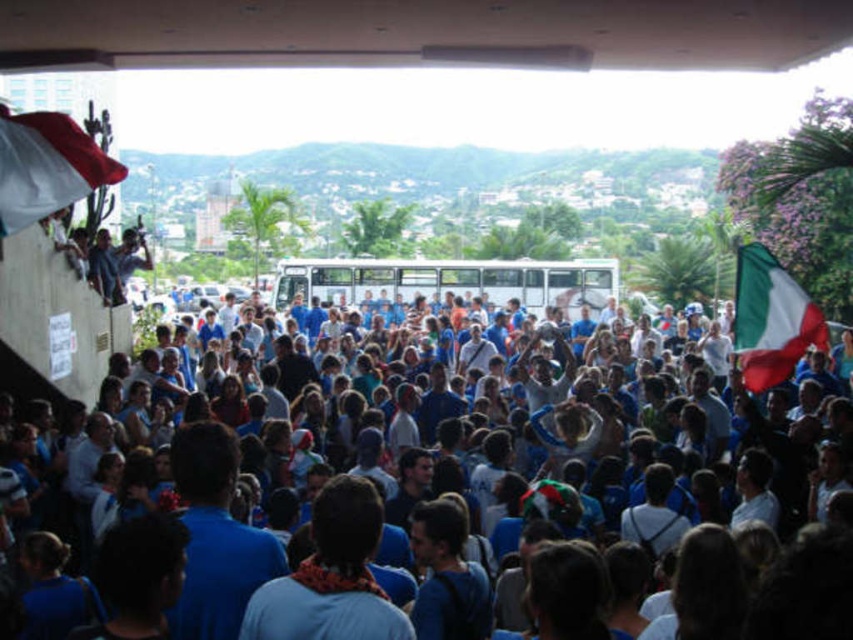
Question: Does blue fabric crowd at center have a lesser width compared to green and white fabric flag at right?

Choices:
 (A) yes
 (B) no

Answer: (B)

Question: Which is nearer to the green and white fabric flag at right?

Choices:
 (A) white fabric flag at upper left
 (B) blue fabric crowd at center

Answer: (B)

Question: Does blue fabric crowd at center appear over green and white fabric flag at right?

Choices:
 (A) no
 (B) yes

Answer: (A)

Question: Does blue fabric crowd at center appear on the right side of white fabric flag at upper left?

Choices:
 (A) yes
 (B) no

Answer: (A)

Question: Among these points, which one is nearest to the camera?

Choices:
 (A) (746, 424)
 (B) (763, 285)
 (C) (10, 132)

Answer: (C)

Question: Which point is farther from the camera taking this photo?

Choices:
 (A) (363, 406)
 (B) (782, 358)

Answer: (A)